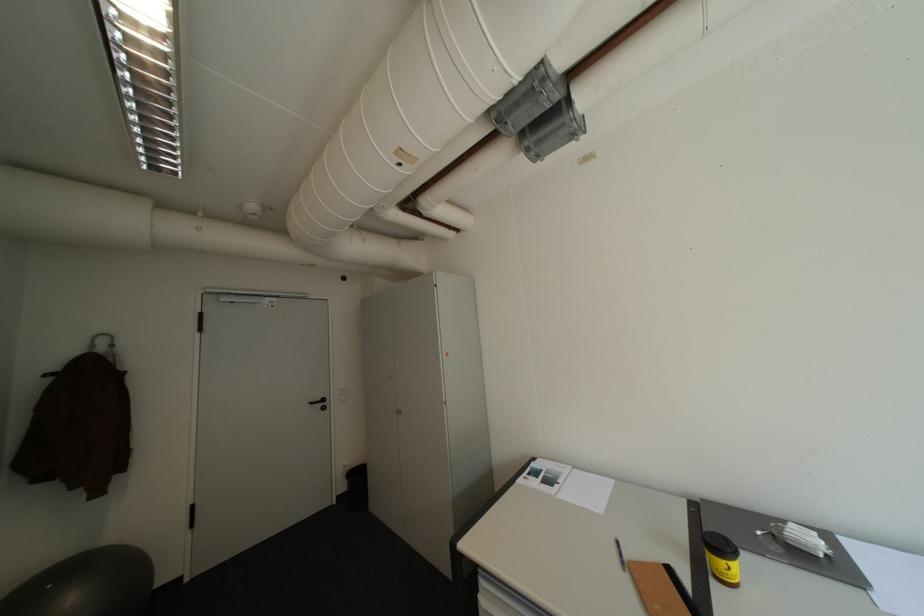
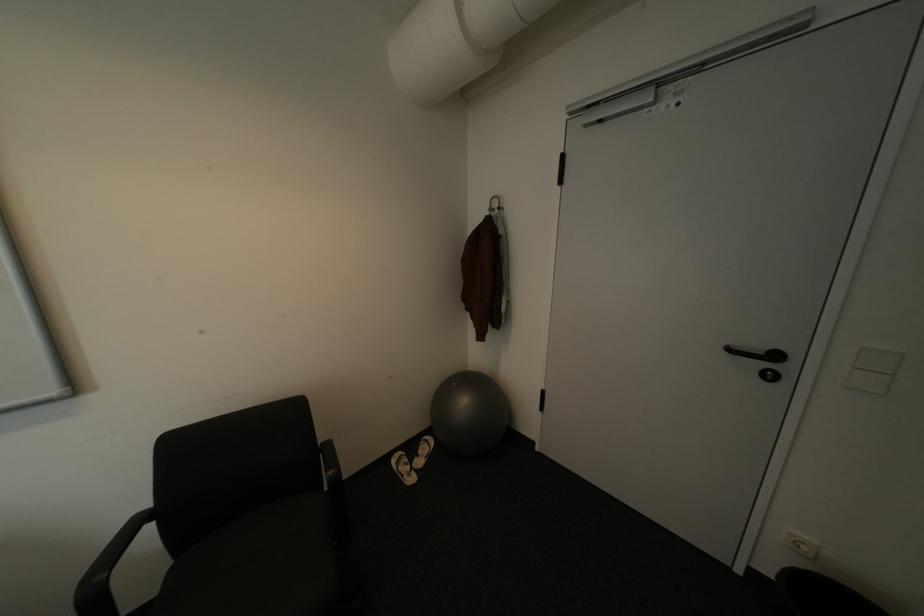
Question: I am providing you with two images of the same scene from different viewpoints. After the viewpoint changes to image2, which objects are now occluded?

Choices:
 (A) grey exercise ball
 (B) light switch
 (C) black chair armrest
 (D) none of these

Answer: (D)